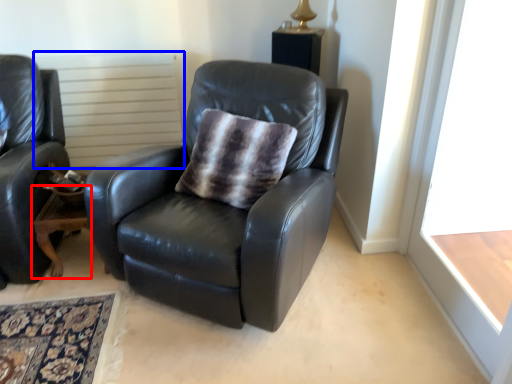
Question: Which object appears closest to the camera in this image, table (highlighted by a red box) or radiator (highlighted by a blue box)?

Choices:
 (A) table
 (B) radiator

Answer: (A)